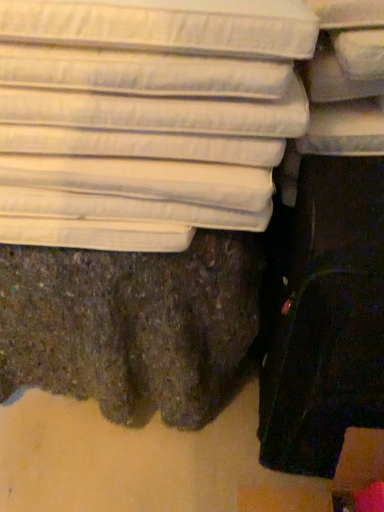
Describe the element at coordinates (161, 116) in the screenshot. I see `white fabric mattress at upper left` at that location.

In order to face white fabric mattress at upper left, should I rotate leftwards or rightwards?

It's best to rotate left around 8.252 degrees.

Where is `white fabric mattress at upper left`? Image resolution: width=384 pixels, height=512 pixels. white fabric mattress at upper left is located at coordinates (161, 116).

Where is `white fabric mattress at upper left`? white fabric mattress at upper left is located at coordinates (161, 116).